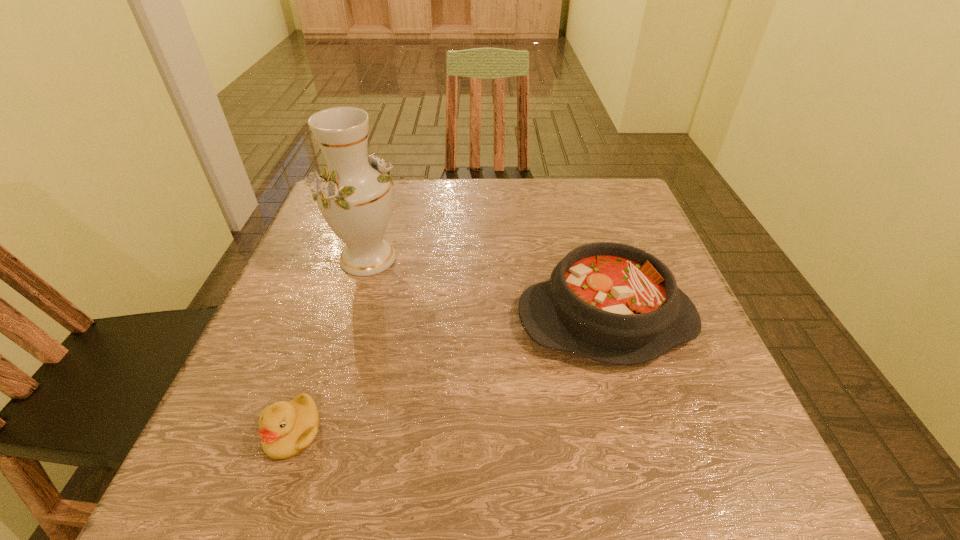
Image resolution: width=960 pixels, height=540 pixels. I want to click on vase, so click(x=355, y=198).

Where is `the second tallest object`? the second tallest object is located at coordinates (614, 303).

I want to click on the rightmost object, so click(x=614, y=303).

Locate an element on the screen. The height and width of the screenshot is (540, 960). the nearest object is located at coordinates (287, 428).

Locate an element on the screen. duckling is located at coordinates (287, 428).

You are a GUI agent. You are given a task and a screenshot of the screen. Output one action in this format:
    pyautogui.click(x=<x>, y=<y>)
    Task: Click on the vacant space located 0.070m on the front of the tallest object
    
    Given the screenshot: What is the action you would take?
    pyautogui.click(x=353, y=307)

You are a GUI agent. You are given a task and a screenshot of the screen. Output one action in this format:
    pyautogui.click(x=<x>, y=<y>)
    Task: Click on the blank area located 0.130m on the front of the rightmost object
    Image resolution: width=960 pixels, height=540 pixels.
    Given the screenshot: What is the action you would take?
    pyautogui.click(x=641, y=447)

You are a GUI agent. You are given a task and a screenshot of the screen. Output one action in this format:
    pyautogui.click(x=<x>, y=<y>)
    Task: Click on the object situated at the near edge
    The width and height of the screenshot is (960, 540).
    Given the screenshot: What is the action you would take?
    pyautogui.click(x=287, y=428)

Locate an element on the screen. The width and height of the screenshot is (960, 540). vase present at the left edge is located at coordinates (355, 198).

This screenshot has height=540, width=960. Find the location of `duckling at the left edge`. duckling at the left edge is located at coordinates (287, 428).